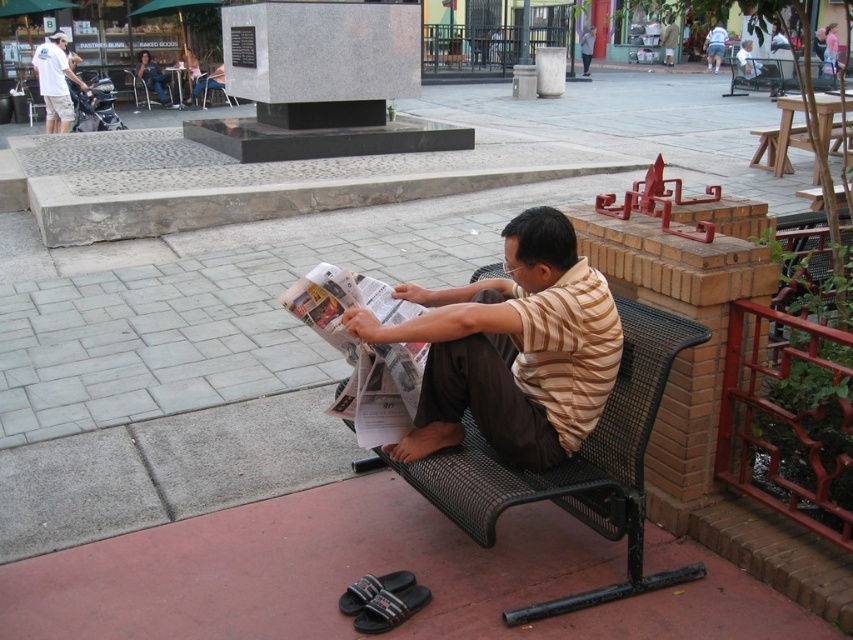
Question: Considering the real-world distances, which object is farthest from the brown striped shirt at center?

Choices:
 (A) black mesh park bench at center
 (B) denim shorts at lower right
 (C) light brown leather jacket at center
 (D) white shirt at upper left

Answer: (C)

Question: Among these points, which one is farthest from the camera?

Choices:
 (A) (712, 26)
 (B) (527, 285)

Answer: (A)

Question: Can you confirm if brown striped shirt at center is positioned to the left of denim shorts at lower right?

Choices:
 (A) yes
 (B) no

Answer: (A)

Question: Is the position of brown striped shirt at center less distant than that of black mesh park bench at center?

Choices:
 (A) yes
 (B) no

Answer: (B)

Question: Does denim shorts at lower right have a lesser width compared to light brown leather jacket at center?

Choices:
 (A) no
 (B) yes

Answer: (A)

Question: Which object appears farthest from the camera in this image?

Choices:
 (A) denim shorts at lower right
 (B) light brown leather jacket at center
 (C) black mesh park bench at center
 (D) brown striped shirt at center

Answer: (B)